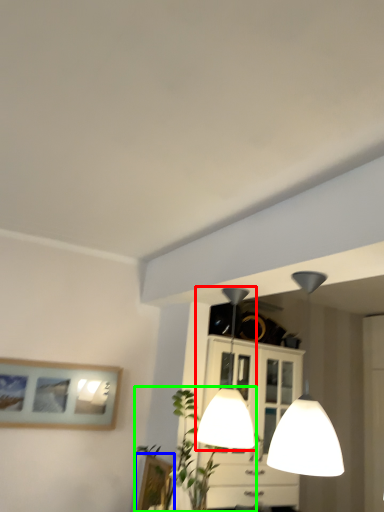
Question: Considering the real-world distances, which object is closest to lamp (highlighted by a red box)? picture frame (highlighted by a blue box) or plant (highlighted by a green box).

Choices:
 (A) picture frame
 (B) plant

Answer: (B)